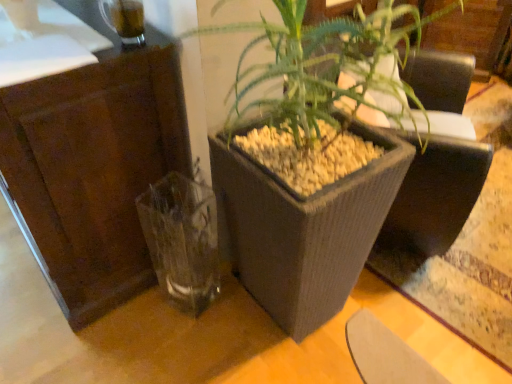
Question: Is matte gray planter at center wider or thinner than brown wood dresser at left?

Choices:
 (A) thin
 (B) wide

Answer: (A)

Question: Considering the relative positions of matte gray planter at center and brown wood dresser at left in the image provided, is matte gray planter at center to the left or to the right of brown wood dresser at left?

Choices:
 (A) left
 (B) right

Answer: (B)

Question: Which object is positioned closest to the transparent glass vase at lower left?

Choices:
 (A) brown wood dresser at left
 (B) matte gray planter at center

Answer: (A)

Question: Based on their relative distances, which object is nearer to the matte gray planter at center?

Choices:
 (A) transparent glass vase at lower left
 (B) brown wood dresser at left

Answer: (A)